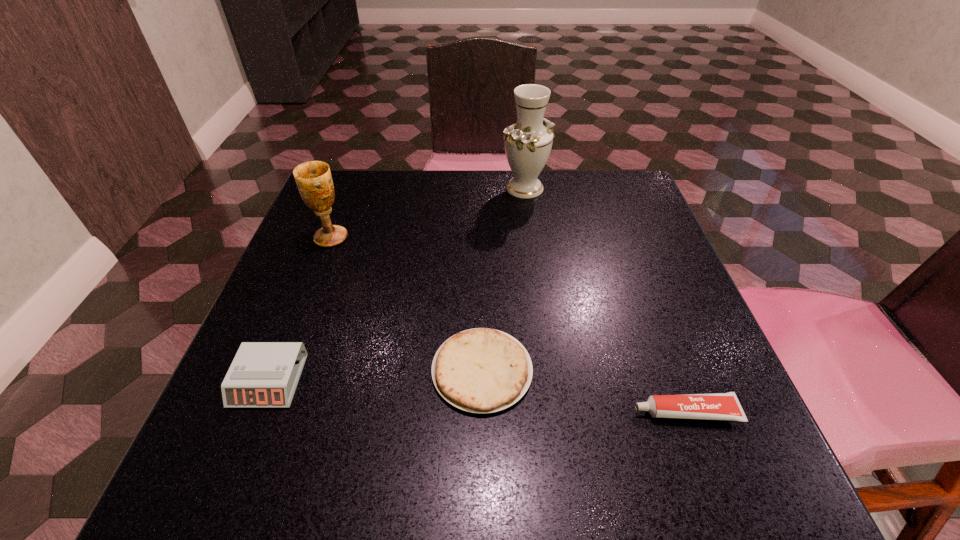
This screenshot has width=960, height=540. I want to click on vase, so click(528, 143).

At what (x,y) coordinates should I click in order to perform the action: click on the tallest object. Please return your answer as a coordinate pair (x, y). The image size is (960, 540). Looking at the image, I should click on (528, 143).

Locate an element on the screen. the second farthest object is located at coordinates (314, 181).

Locate an element on the screen. The image size is (960, 540). the fourth shortest object is located at coordinates (314, 181).

The width and height of the screenshot is (960, 540). Find the location of `the third tallest object`. the third tallest object is located at coordinates (263, 374).

This screenshot has width=960, height=540. I want to click on the second shortest object, so click(716, 406).

Locate an element on the screen. The image size is (960, 540). toothpaste is located at coordinates (716, 406).

Image resolution: width=960 pixels, height=540 pixels. Find the location of `tortilla`. tortilla is located at coordinates (481, 370).

Image resolution: width=960 pixels, height=540 pixels. Find the location of `vacant space positioned on the front of the farthest object`. vacant space positioned on the front of the farthest object is located at coordinates (532, 244).

This screenshot has height=540, width=960. What are the coordinates of `free space located 0.390m on the front of the fourth shortest object` in the screenshot? It's located at (264, 411).